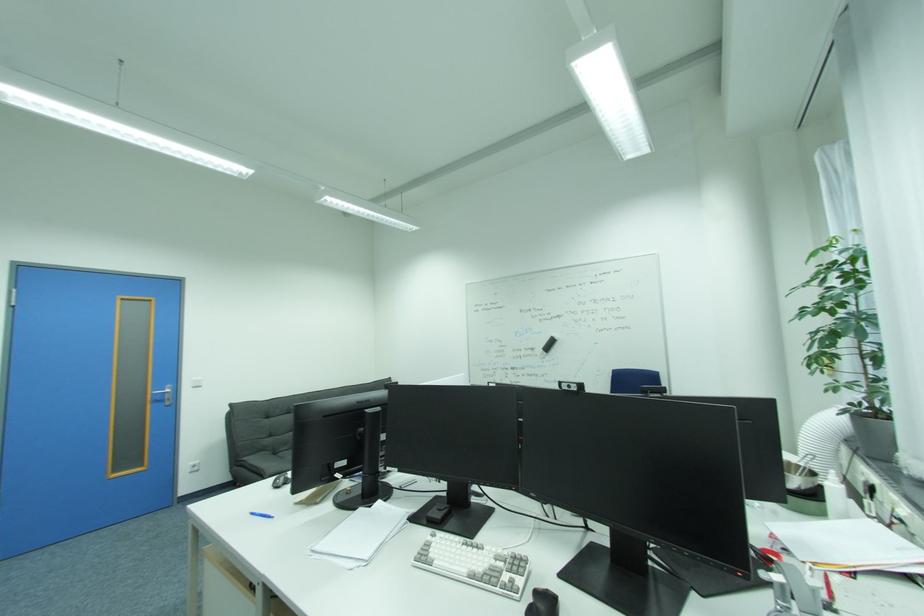
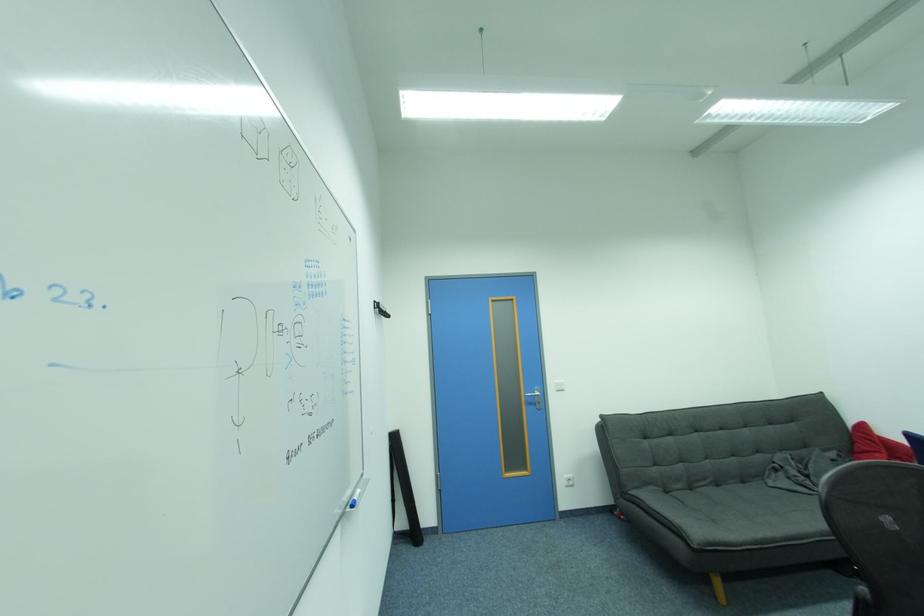
Locate, in the second image, the point that corresponds to pixel 201 379 in the first image.

(564, 382)